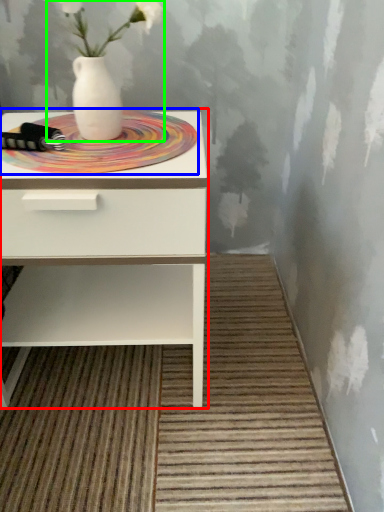
Question: Estimate the real-world distances between objects in this image. Which object is farther from nightstand (highlighted by a red box), mat (highlighted by a blue box) or floral arrangement (highlighted by a green box)?

Choices:
 (A) mat
 (B) floral arrangement

Answer: (B)